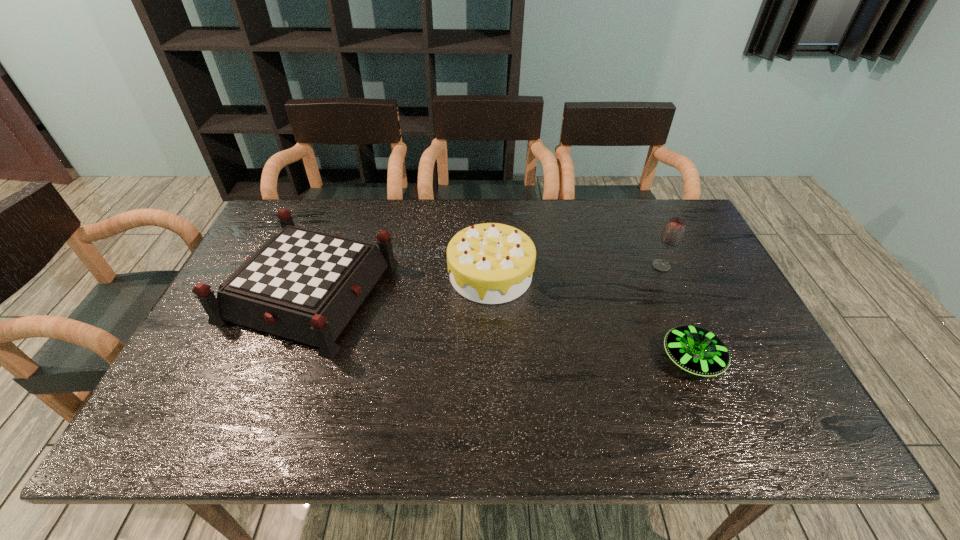
This screenshot has height=540, width=960. In order to click on glass drink container in this screenshot , I will do `click(673, 232)`.

Image resolution: width=960 pixels, height=540 pixels. In order to click on the third object from right to left in this screenshot , I will do `click(490, 263)`.

Where is `the leftmost object`? Image resolution: width=960 pixels, height=540 pixels. the leftmost object is located at coordinates (304, 285).

In order to click on the shortest object in this screenshot , I will do `click(696, 350)`.

Locate an element on the screen. This screenshot has width=960, height=540. vacant point located 0.240m on the front of the glass drink container is located at coordinates (692, 338).

Find the location of a particular element. This screenshot has height=540, width=960. free space located on the front of the birthday cake is located at coordinates (493, 387).

The width and height of the screenshot is (960, 540). Find the location of `vacant region located on the right of the checkerboard`. vacant region located on the right of the checkerboard is located at coordinates (536, 292).

Locate an element on the screen. The height and width of the screenshot is (540, 960). free space located 0.170m on the back of the saucer is located at coordinates (661, 288).

You are a GUI agent. You are given a task and a screenshot of the screen. Output one action in this format:
    pyautogui.click(x=<x>, y=<y>)
    Task: Click on the object that is at the far edge
    This screenshot has width=960, height=540.
    Given the screenshot: What is the action you would take?
    [304, 285]

The image size is (960, 540). I want to click on object at the left edge, so click(x=304, y=285).